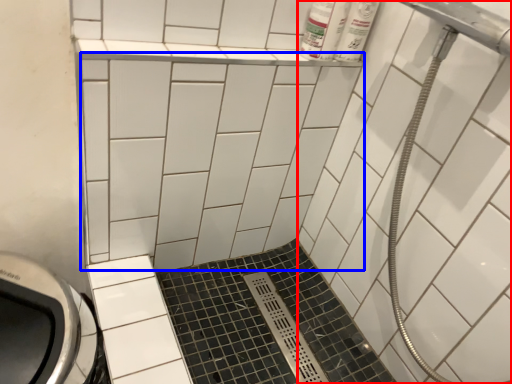
Question: Which object appears farthest to the camera in this image, bath (highlighted by a red box) or ceramic tile (highlighted by a blue box)?

Choices:
 (A) bath
 (B) ceramic tile

Answer: (B)